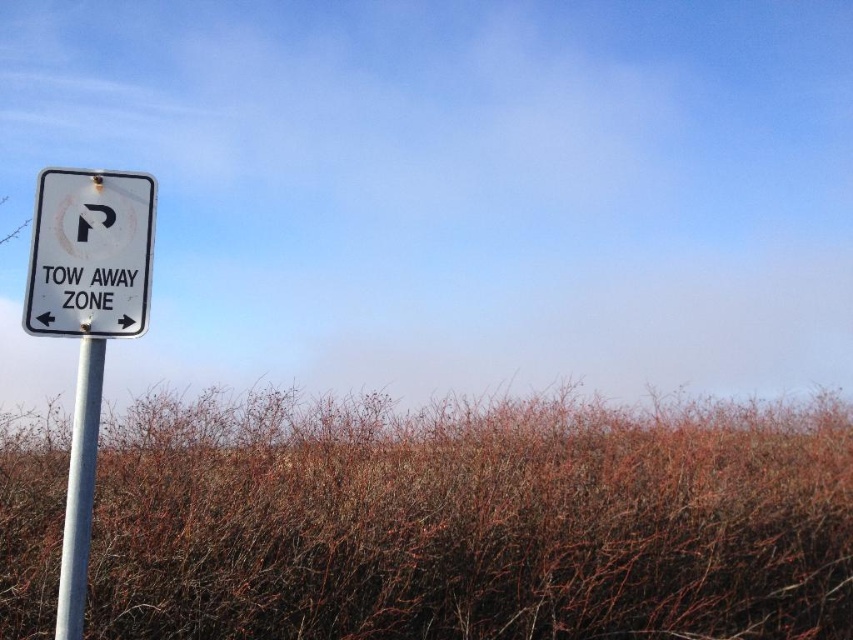
Can you confirm if white metallic sign at left is positioned below white plastic sign at upper left?

Correct, white metallic sign at left is located below white plastic sign at upper left.

The height and width of the screenshot is (640, 853). What do you see at coordinates (86, 321) in the screenshot?
I see `white metallic sign at left` at bounding box center [86, 321].

This screenshot has height=640, width=853. Identify the location of white metallic sign at left. (86, 321).

Where is `white metallic sign at left`? The height and width of the screenshot is (640, 853). white metallic sign at left is located at coordinates (86, 321).

Is brown dry grass at left above metallic pole at left?

Incorrect, brown dry grass at left is not positioned above metallic pole at left.

Is brown dry grass at left taller than metallic pole at left?

Incorrect, brown dry grass at left's height is not larger of metallic pole at left's.

Find the location of a particular element. This screenshot has width=853, height=640. brown dry grass at left is located at coordinates (471, 520).

Locate an element on the screen. The image size is (853, 640). brown dry grass at left is located at coordinates (471, 520).

Who is more forward, (180, 449) or (74, 326)?

Point (74, 326) is in front.

The height and width of the screenshot is (640, 853). In order to click on brown dry grass at left in this screenshot , I will do `click(471, 520)`.